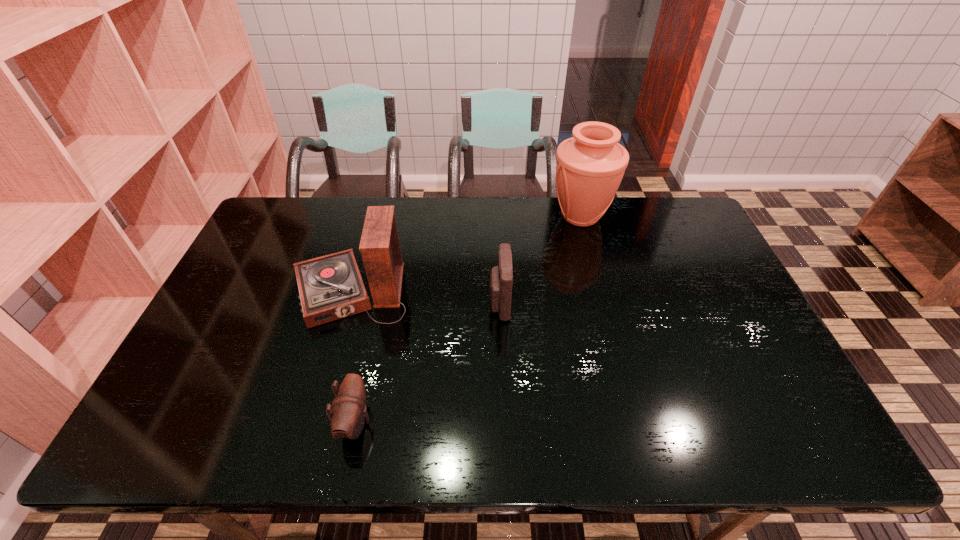
You are a GUI agent. You are given a task and a screenshot of the screen. Output one action in this format:
    pyautogui.click(x=<x>, y=<y>)
    Task: Click on the free spot located 0.320m with an open flap on the third object from left to right
    The image size is (960, 540).
    Given the screenshot: What is the action you would take?
    pyautogui.click(x=378, y=303)

Where is `vacant region located 0.090m with an open flap on the third object from left to right`? This screenshot has height=540, width=960. vacant region located 0.090m with an open flap on the third object from left to right is located at coordinates (458, 303).

Where is `vacant space located 0.260m with the flap open on the shortest object`? vacant space located 0.260m with the flap open on the shortest object is located at coordinates (484, 422).

This screenshot has width=960, height=540. I want to click on object present at the far edge, so click(x=590, y=166).

I want to click on object present at the near edge, so click(349, 413).

Image resolution: width=960 pixels, height=540 pixels. In the image, there is a desktop. Identify the location of vacant space at the far edge. (396, 208).

You are a GUI agent. You are given a task and a screenshot of the screen. Output one action in this format:
    pyautogui.click(x=<x>, y=<y>)
    Task: Click on the vacant space at the near edge of the desktop
    
    Given the screenshot: What is the action you would take?
    pyautogui.click(x=270, y=443)

Where is `free space at the left edge`? This screenshot has height=540, width=960. free space at the left edge is located at coordinates pyautogui.click(x=215, y=355).

The width and height of the screenshot is (960, 540). In the image, there is a desktop. What are the coordinates of `vacant space at the right edge` in the screenshot? It's located at (770, 402).

Locate an element on the screen. vacant space at the far left corner of the desktop is located at coordinates (311, 212).